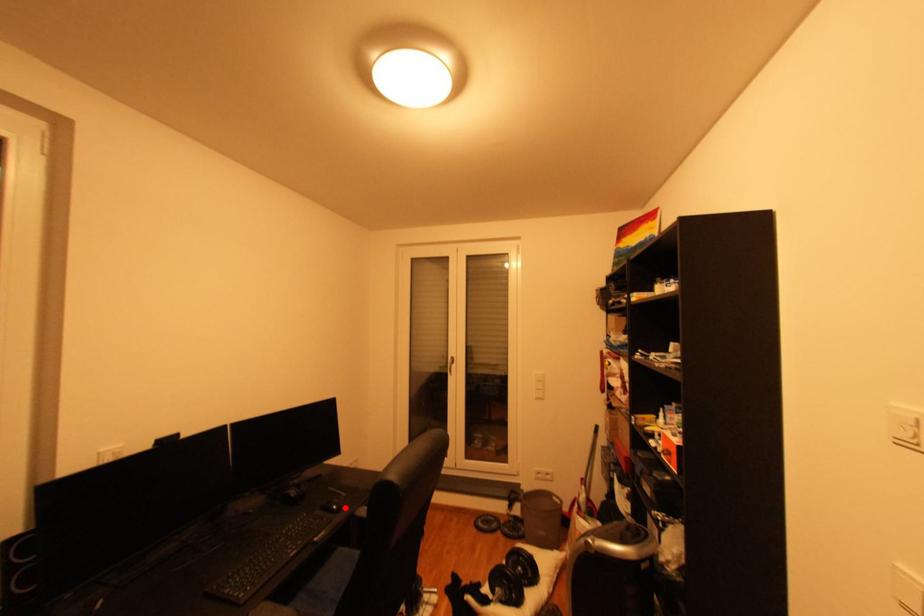
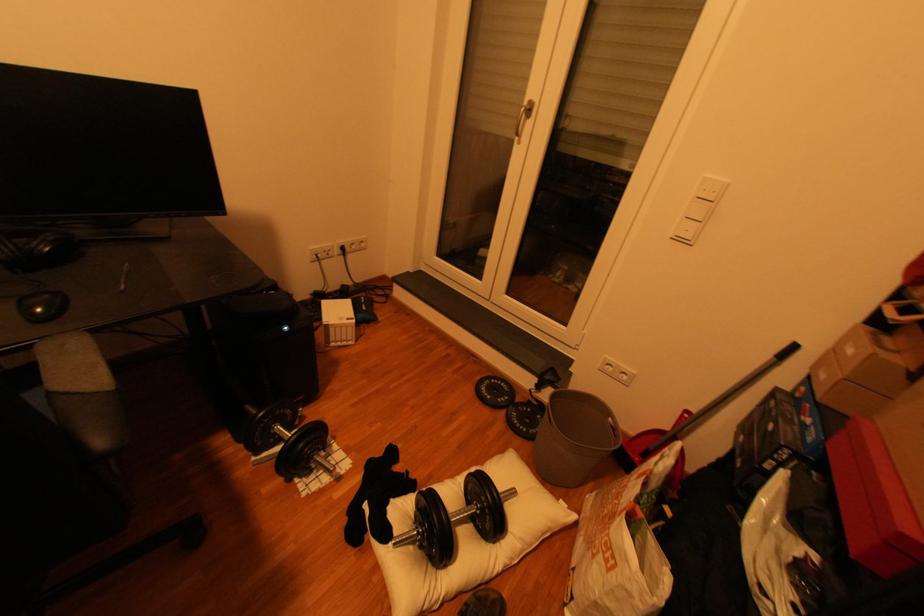
Find the pixel in the second image that matches the highlighted location in the first image.

(47, 310)